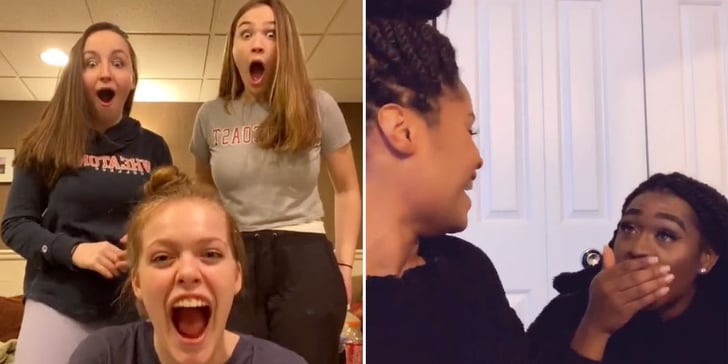
You are a GUI agent. You are given a task and a screenshot of the screen. Output one action in this format:
    pyautogui.click(x=<x>, y=<y>)
    Task: Click on the lightbulb
    
    Given the screenshot: What is the action you would take?
    point(54,56)